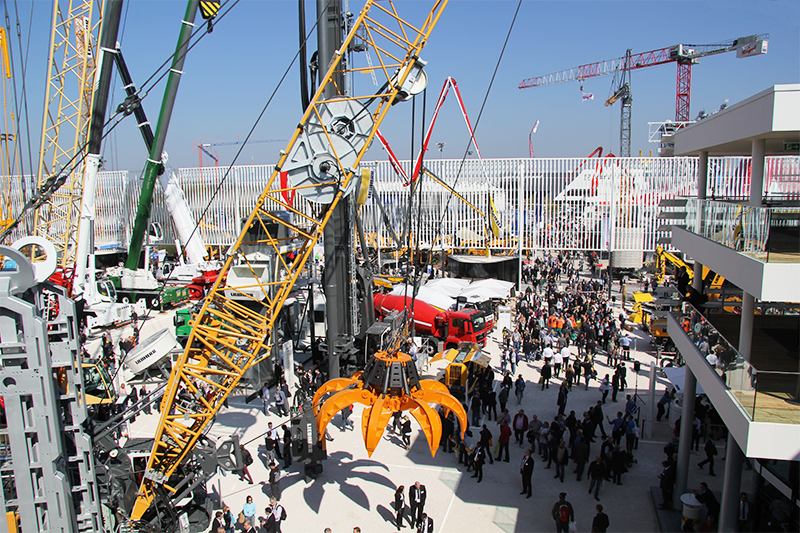
The height and width of the screenshot is (533, 800). I want to click on cable, so click(x=442, y=215).